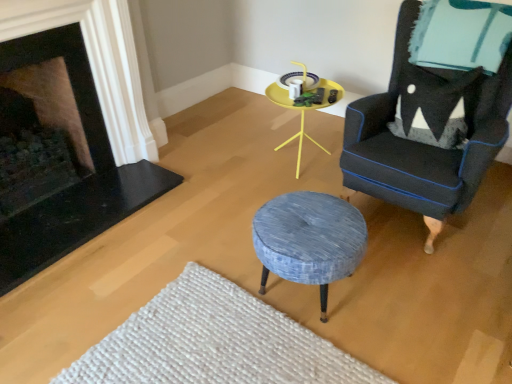
Identify the location of free space in front of black stone fireplace at left, marked as the first fireplace in a right-to-left arrangement. (91, 288).